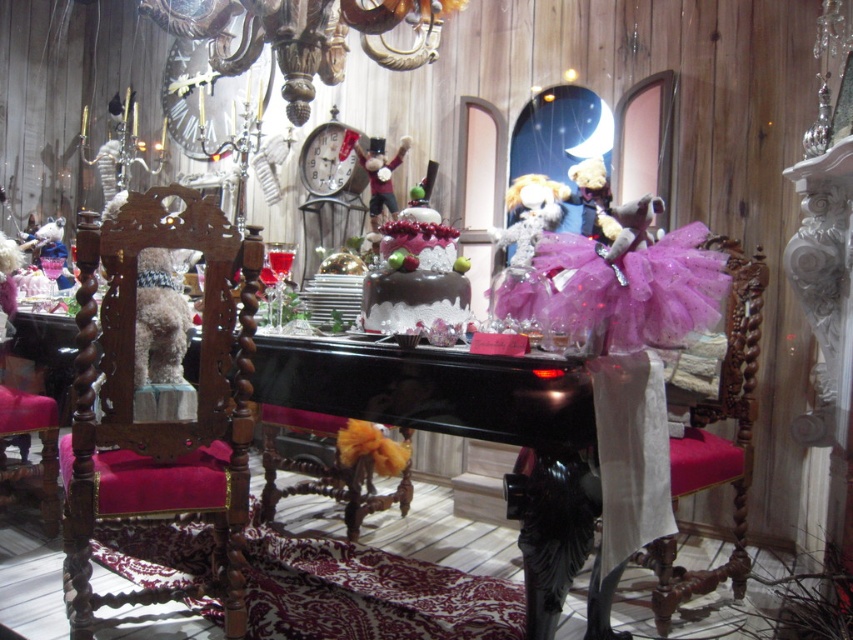
Question: Which point is closer to the camera?

Choices:
 (A) (700, 228)
 (B) (77, 458)

Answer: (A)

Question: Which point is farther to the camera?

Choices:
 (A) chocolate frosted cake at center
 (B) black glossy piano at center
 (C) purple tulle skirt at right
 (D) velvet teddy bear at center

Answer: (D)

Question: Which object appears farthest from the camera in this image?

Choices:
 (A) fuzzy plush toy at center
 (B) black glossy piano at center
 (C) chocolate frosted cake at center
 (D) velvet teddy bear at center

Answer: (A)

Question: Is fuzzy plush toy at center wider than velvet teddy bear at center?

Choices:
 (A) yes
 (B) no

Answer: (A)

Question: Is purple tulle dress at center bigger than velvet teddy bear at center?

Choices:
 (A) no
 (B) yes

Answer: (B)

Question: Can you confirm if velvet red chair at left is wider than fuzzy plush toy at center?

Choices:
 (A) no
 (B) yes

Answer: (B)